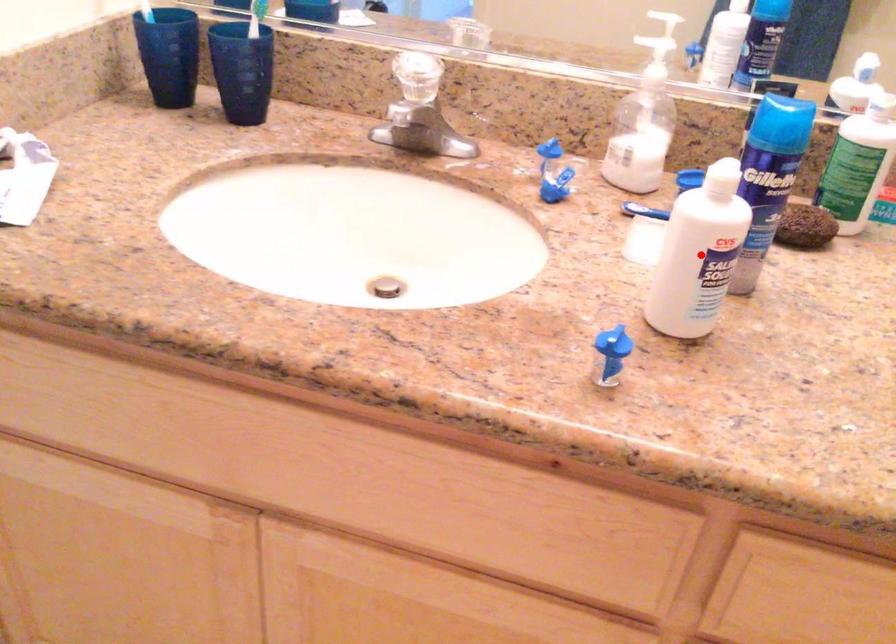
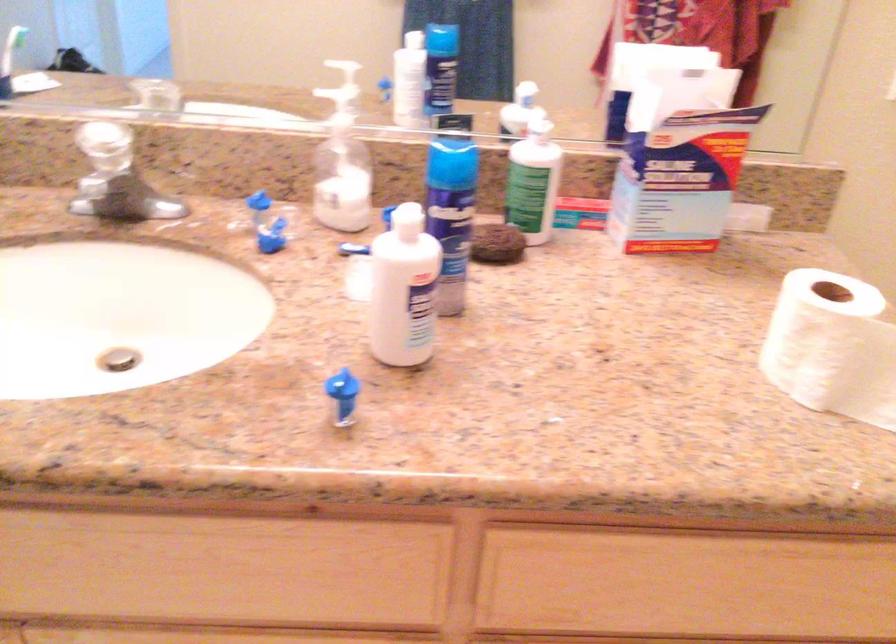
Where in the second image is the point corresponding to the highlighted location from the first image?

(403, 289)